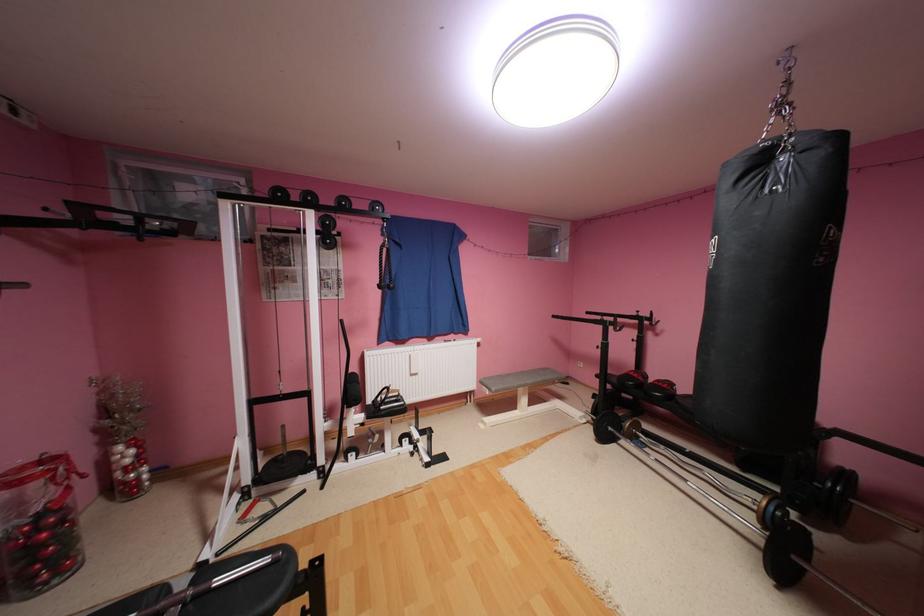
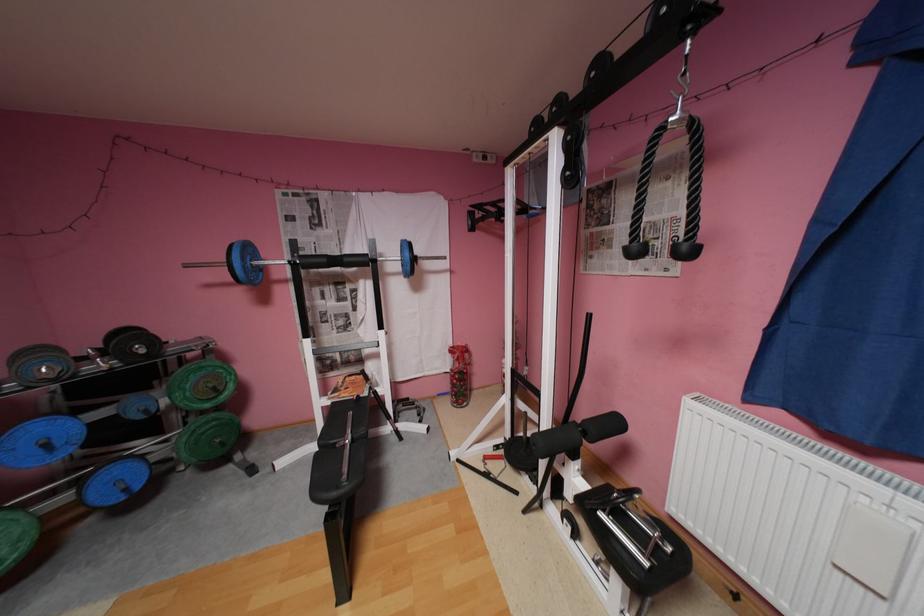
In the second image, find the point that corresponds to point 400,285 in the first image.

(695, 246)